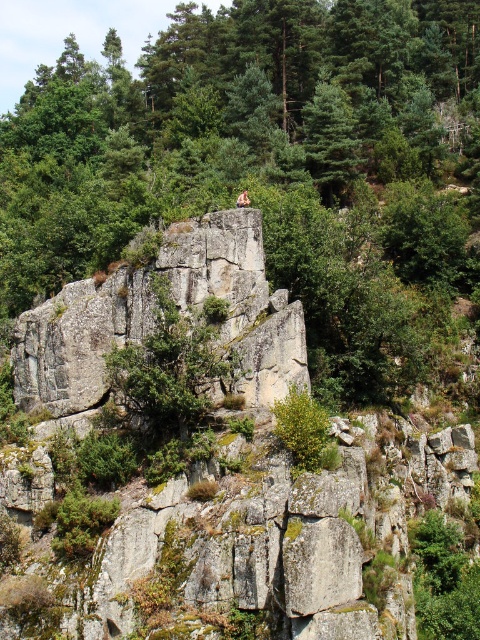
Does green leafy tree at upper center have a lesser width compared to tan skin rock climber at center?

Incorrect, green leafy tree at upper center's width is not less than tan skin rock climber at center's.

In the scene shown: Who is more distant from viewer, (230, 58) or (239, 198)?

The point (230, 58) is more distant.

Find the location of a particular element. This screenshot has height=640, width=480. green leafy tree at upper center is located at coordinates (x=264, y=164).